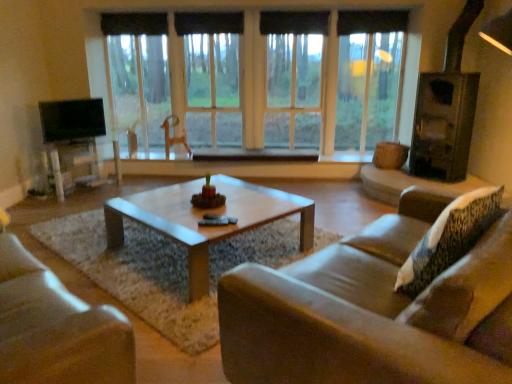
Measure the distance between point (219, 14) and camera.

Point (219, 14) and camera are 5.21 meters apart from each other.

The width and height of the screenshot is (512, 384). Describe the element at coordinates (134, 24) in the screenshot. I see `black fabric curtain at upper center, arranged as the 1th curtain when viewed from the left` at that location.

How much space does black fabric curtain at upper center, arranged as the 1th curtain when viewed from the left, occupy horizontally?

black fabric curtain at upper center, arranged as the 1th curtain when viewed from the left, is 4.47 inches in width.

Describe the element at coordinates (294, 22) in the screenshot. I see `black fabric curtain at upper center, placed as the third curtain when sorted from left to right` at that location.

Locate an element on the screen. black fabric curtain at upper center, the 2th curtain when ordered from left to right is located at coordinates (208, 23).

Locate an element on the screen. Image resolution: width=512 pixels, height=384 pixels. the 1st curtain counting from the right side of the black fabric curtain at upper center, which is the 3th curtain from right to left is located at coordinates (208, 23).

Considering the sizes of objects black fabric curtain at upper center, the 2th curtain when ordered from left to right, and black fabric curtain at upper center, which is the 3th curtain from right to left, in the image provided, who is wider, black fabric curtain at upper center, the 2th curtain when ordered from left to right, or black fabric curtain at upper center, which is the 3th curtain from right to left,?

With larger width is black fabric curtain at upper center, the 2th curtain when ordered from left to right.

Is black fabric curtain at upper center, the 2th curtain when ordered from left to right, turned away from black fabric curtain at upper center, which is the 3th curtain from right to left?

black fabric curtain at upper center, the 2th curtain when ordered from left to right, does not have its back to black fabric curtain at upper center, which is the 3th curtain from right to left.

From a real-world perspective, is black fabric curtain at upper center, the second curtain in the right-to-left sequence, under black fabric curtain at upper center, which is the 3th curtain from right to left?

Yes.

Which object is thinner, black fabric curtain at upper center, arranged as the 1th curtain when viewed from the left, or black fabric curtain at upper center, placed as the third curtain when sorted from left to right?

With smaller width is black fabric curtain at upper center, placed as the third curtain when sorted from left to right.

Do you think black fabric curtain at upper center, arranged as the 1th curtain when viewed from the left, is within black fabric curtain at upper center, placed as the third curtain when sorted from left to right, or outside of it?

black fabric curtain at upper center, arranged as the 1th curtain when viewed from the left, is spatially situated outside black fabric curtain at upper center, placed as the third curtain when sorted from left to right.

Considering the sizes of objects black fabric curtain at upper center, which is the 3th curtain from right to left, and black fabric curtain at upper center, the first curtain when ordered from right to left, in the image provided, who is taller, black fabric curtain at upper center, which is the 3th curtain from right to left, or black fabric curtain at upper center, the first curtain when ordered from right to left,?

black fabric curtain at upper center, the first curtain when ordered from right to left.

Does black fabric curtain at upper center, which is the 3th curtain from right to left, have a smaller size compared to black fabric curtain at upper center, placed as the third curtain when sorted from left to right?

No.

Is black fabric curtain at upper center, the second curtain in the right-to-left sequence, bigger or smaller than brown leather couch at center, positioned as the 2th studio couch in left-to-right order?

In the image, black fabric curtain at upper center, the second curtain in the right-to-left sequence, appears to be smaller than brown leather couch at center, positioned as the 2th studio couch in left-to-right order.

Is point (175, 17) behind point (375, 289)?

Yes, it is.

Which is behind, black fabric curtain at upper center, the 2th curtain when ordered from left to right, or brown leather couch at center, which appears as the first studio couch when viewed from the right?

black fabric curtain at upper center, the 2th curtain when ordered from left to right, is more distant.

Is brown leather couch at center, which appears as the first studio couch when viewed from the right, taller or shorter than black fabric curtain at upper center, arranged as the 1th curtain when viewed from the left?

In the image, brown leather couch at center, which appears as the first studio couch when viewed from the right, appears to be taller than black fabric curtain at upper center, arranged as the 1th curtain when viewed from the left.

Is brown leather couch at center, positioned as the 2th studio couch in left-to-right order, looking in the opposite direction of black fabric curtain at upper center, which is the 3th curtain from right to left?

No, brown leather couch at center, positioned as the 2th studio couch in left-to-right order,'s orientation is not away from black fabric curtain at upper center, which is the 3th curtain from right to left.

Considering the relative positions of brown leather couch at center, which appears as the first studio couch when viewed from the right, and black fabric curtain at upper center, which is the 3th curtain from right to left, in the image provided, is brown leather couch at center, which appears as the first studio couch when viewed from the right, to the left of black fabric curtain at upper center, which is the 3th curtain from right to left, from the viewer's perspective?

Incorrect, brown leather couch at center, which appears as the first studio couch when viewed from the right, is not on the left side of black fabric curtain at upper center, which is the 3th curtain from right to left.

Is brown leather couch at center, positioned as the 2th studio couch in left-to-right order, thinner than black fabric curtain at upper center, arranged as the 1th curtain when viewed from the left?

In fact, brown leather couch at center, positioned as the 2th studio couch in left-to-right order, might be wider than black fabric curtain at upper center, arranged as the 1th curtain when viewed from the left.

From a real-world perspective, is brown leather couch at center, positioned as the 2th studio couch in left-to-right order, physically above leather couch at lower left, the first studio couch viewed from the left?

Indeed, from a real-world perspective, brown leather couch at center, positioned as the 2th studio couch in left-to-right order, stands above leather couch at lower left, the first studio couch viewed from the left.

Based on the photo, from the image's perspective, is brown leather couch at center, positioned as the 2th studio couch in left-to-right order, positioned above or below leather couch at lower left, the first studio couch viewed from the left?

Clearly, from the image's perspective, brown leather couch at center, positioned as the 2th studio couch in left-to-right order, is above leather couch at lower left, the first studio couch viewed from the left.

Is brown leather couch at center, which appears as the first studio couch when viewed from the right, inside or outside of leather couch at lower left, the first studio couch viewed from the left?

brown leather couch at center, which appears as the first studio couch when viewed from the right, is not enclosed by leather couch at lower left, the first studio couch viewed from the left.

Would you say brown leather couch at center, positioned as the 2th studio couch in left-to-right order, is a long distance from leather couch at lower left, placed as the second studio couch when sorted from right to left?

No, brown leather couch at center, positioned as the 2th studio couch in left-to-right order, is not far from leather couch at lower left, placed as the second studio couch when sorted from right to left.

Which of these two, black fabric curtain at upper center, placed as the third curtain when sorted from left to right, or leather couch at lower left, placed as the second studio couch when sorted from right to left, stands taller?

With more height is leather couch at lower left, placed as the second studio couch when sorted from right to left.

The width and height of the screenshot is (512, 384). I want to click on the 2nd curtain to the right of the leather couch at lower left, the first studio couch viewed from the left, starting your count from the anchor, so click(x=294, y=22).

Is the surface of black fabric curtain at upper center, placed as the third curtain when sorted from left to right, in direct contact with leather couch at lower left, placed as the second studio couch when sorted from right to left?

No, black fabric curtain at upper center, placed as the third curtain when sorted from left to right, is not with leather couch at lower left, placed as the second studio couch when sorted from right to left.

How far apart are matte white entertainment center at left and black fabric curtain at upper center, placed as the third curtain when sorted from left to right?

matte white entertainment center at left and black fabric curtain at upper center, placed as the third curtain when sorted from left to right, are 8.31 feet apart.

From the image's perspective, count 1st curtains upward from the matte white entertainment center at left and point to it. Please provide its 2D coordinates.

[(294, 22)]

Could you tell me if matte white entertainment center at left is turned towards black fabric curtain at upper center, placed as the third curtain when sorted from left to right?

No, matte white entertainment center at left is not aimed at black fabric curtain at upper center, placed as the third curtain when sorted from left to right.

Is matte white entertainment center at left placed right next to black fabric curtain at upper center, the first curtain when ordered from right to left?

No, matte white entertainment center at left is not touching black fabric curtain at upper center, the first curtain when ordered from right to left.

The image size is (512, 384). Identify the location of the 1st curtain to the right of the black fabric curtain at upper center, which is the 3th curtain from right to left, starting your count from the anchor. (208, 23).

From the black fabric curtain at upper center, placed as the third curtain when sorted from left to right, count the 2nd curtain to the left and point to it. Please provide its 2D coordinates.

[(134, 24)]

Which object lies nearer to the anchor point transparent glass window at center, matte white entertainment center at left or leather couch at lower left, the first studio couch viewed from the left?

The object closer to transparent glass window at center is matte white entertainment center at left.

In the scene shown: Estimate the real-world distances between objects in this image. Which object is further from transparent glass window at center, black fabric curtain at upper center, which is the 3th curtain from right to left, or black fabric curtain at upper center, the 2th curtain when ordered from left to right?

black fabric curtain at upper center, which is the 3th curtain from right to left, is positioned further to the anchor transparent glass window at center.

From the picture: When comparing their distances from transparent glass window at center, does black fabric curtain at upper center, the 2th curtain when ordered from left to right, or matte white entertainment center at left seem further?

Based on the image, matte white entertainment center at left appears to be further to transparent glass window at center.

From the image, which object appears to be farther from transparent glass window at center, black fabric curtain at upper center, placed as the third curtain when sorted from left to right, or black fabric curtain at upper center, the second curtain in the right-to-left sequence?

Among the two, black fabric curtain at upper center, the second curtain in the right-to-left sequence, is located further to transparent glass window at center.

Based on their spatial positions, is matte white entertainment center at left or brown leather couch at center, which appears as the first studio couch when viewed from the right, closer to black fabric curtain at upper center, which is the 3th curtain from right to left?

Among the two, matte white entertainment center at left is located nearer to black fabric curtain at upper center, which is the 3th curtain from right to left.

Which object lies further to the anchor point black fabric curtain at upper center, the first curtain when ordered from right to left, black fabric curtain at upper center, the second curtain in the right-to-left sequence, or transparent glass window at center?

Based on the image, transparent glass window at center appears to be further to black fabric curtain at upper center, the first curtain when ordered from right to left.

Based on their spatial positions, is black fabric curtain at upper center, placed as the third curtain when sorted from left to right, or transparent glass window at center closer to leather couch at lower left, the first studio couch viewed from the left?

transparent glass window at center is positioned closer to the anchor leather couch at lower left, the first studio couch viewed from the left.

Considering their positions, is leather couch at lower left, the first studio couch viewed from the left, positioned further to black fabric curtain at upper center, arranged as the 1th curtain when viewed from the left, than black fabric curtain at upper center, the 2th curtain when ordered from left to right?

leather couch at lower left, the first studio couch viewed from the left, is further to black fabric curtain at upper center, arranged as the 1th curtain when viewed from the left.

Locate an element on the screen. window located between black fabric curtain at upper center, the 2th curtain when ordered from left to right, and black fabric curtain at upper center, the first curtain when ordered from right to left, in the left-right direction is located at coordinates (286, 91).

Where is `entertainment center between brown leather couch at center, positioned as the 2th studio couch in left-to-right order, and black fabric curtain at upper center, which is the 3th curtain from right to left, in the front-back direction`? The image size is (512, 384). entertainment center between brown leather couch at center, positioned as the 2th studio couch in left-to-right order, and black fabric curtain at upper center, which is the 3th curtain from right to left, in the front-back direction is located at coordinates (70, 127).

At what (x,y) coordinates should I click in order to perform the action: click on window between leather couch at lower left, placed as the second studio couch when sorted from right to left, and black fabric curtain at upper center, the first curtain when ordered from right to left, in the front-back direction. Please return your answer as a coordinate pair (x, y). Looking at the image, I should click on (286, 91).

Where is `entertainment center located between leather couch at lower left, placed as the second studio couch when sorted from right to left, and black fabric curtain at upper center, arranged as the 1th curtain when viewed from the left, in the depth direction`? entertainment center located between leather couch at lower left, placed as the second studio couch when sorted from right to left, and black fabric curtain at upper center, arranged as the 1th curtain when viewed from the left, in the depth direction is located at coordinates (70, 127).